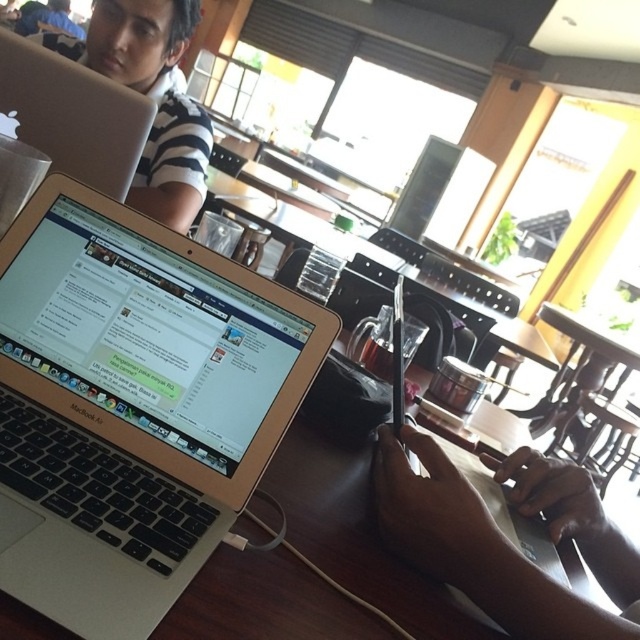
In the scene shown: Who is taller, wooden table at center or silver metallic laptop at upper left?

Standing taller between the two is silver metallic laptop at upper left.

You are a GUI agent. You are given a task and a screenshot of the screen. Output one action in this format:
    pyautogui.click(x=<x>, y=<y>)
    Task: Click on the wooden table at center
    
    Given the screenshot: What is the action you would take?
    pyautogui.click(x=356, y=536)

Find the location of a particular element. wooden table at center is located at coordinates (356, 536).

Who is shorter, smooth skin hands at center or silver metallic laptop at upper left?

Standing shorter between the two is smooth skin hands at center.

Can you confirm if smooth skin hands at center is taller than silver metallic laptop at upper left?

No.

At what (x,y) coordinates should I click in order to perform the action: click on smooth skin hands at center. Please return your answer as a coordinate pair (x, y). Looking at the image, I should click on (474, 547).

Can you confirm if wooden table at center is positioned to the left of smooth skin hands at center?

Correct, you'll find wooden table at center to the left of smooth skin hands at center.

Does wooden table at center appear over smooth skin hands at center?

Yes, wooden table at center is above smooth skin hands at center.

The width and height of the screenshot is (640, 640). What are the coordinates of `wooden table at center` in the screenshot? It's located at pyautogui.click(x=356, y=536).